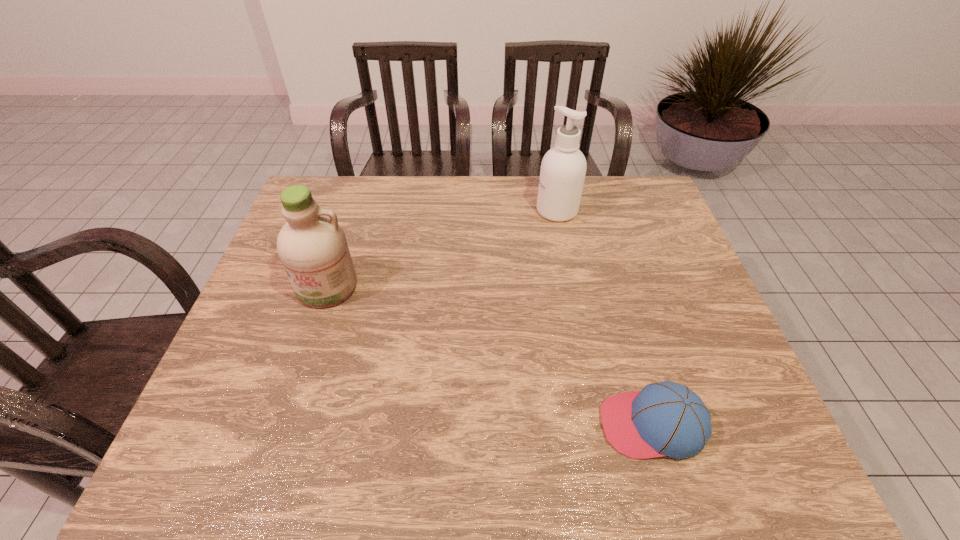
Where is `free space at the left edge of the desktop`? The image size is (960, 540). free space at the left edge of the desktop is located at coordinates (270, 312).

Identify the location of free spot at the right edge of the desktop. The image size is (960, 540). (684, 313).

Identify the location of vacant region at the near left corner of the desktop. The image size is (960, 540). (235, 460).

Image resolution: width=960 pixels, height=540 pixels. In the image, there is a desktop. Identify the location of free region at the far right corner. (658, 214).

Find the location of `vacant space that is in between the nearer cleansing agent and the baseball cap`. vacant space that is in between the nearer cleansing agent and the baseball cap is located at coordinates (490, 356).

You are a GUI agent. You are given a task and a screenshot of the screen. Output one action in this format:
    pyautogui.click(x=<x>, y=<y>)
    Task: Click on the empty location between the baseball cap and the right cleansing agent
    The height and width of the screenshot is (540, 960).
    Given the screenshot: What is the action you would take?
    pyautogui.click(x=605, y=318)

Where is `vacant area that lies between the second nearest object and the farther cleansing agent`? vacant area that lies between the second nearest object and the farther cleansing agent is located at coordinates (442, 248).

Where is `vacant space that is in between the baseball cap and the second nearest object`? This screenshot has width=960, height=540. vacant space that is in between the baseball cap and the second nearest object is located at coordinates (490, 356).

In order to click on empty space between the nearer cleansing agent and the farther cleansing agent in this screenshot , I will do `click(442, 248)`.

The width and height of the screenshot is (960, 540). I want to click on vacant space in between the leftmost object and the shortest object, so click(x=490, y=356).